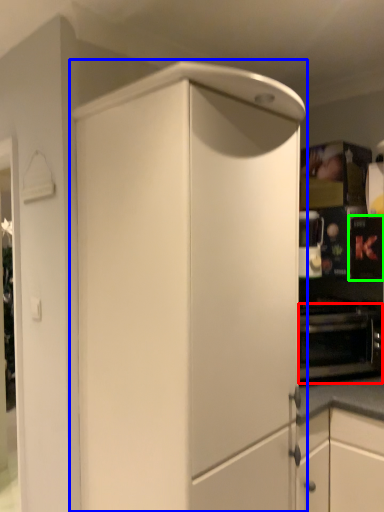
Question: Considering the real-world distances, which object is closest to oven (highlighted by a red box)? cabinetry (highlighted by a blue box) or appliance (highlighted by a green box).

Choices:
 (A) cabinetry
 (B) appliance

Answer: (B)